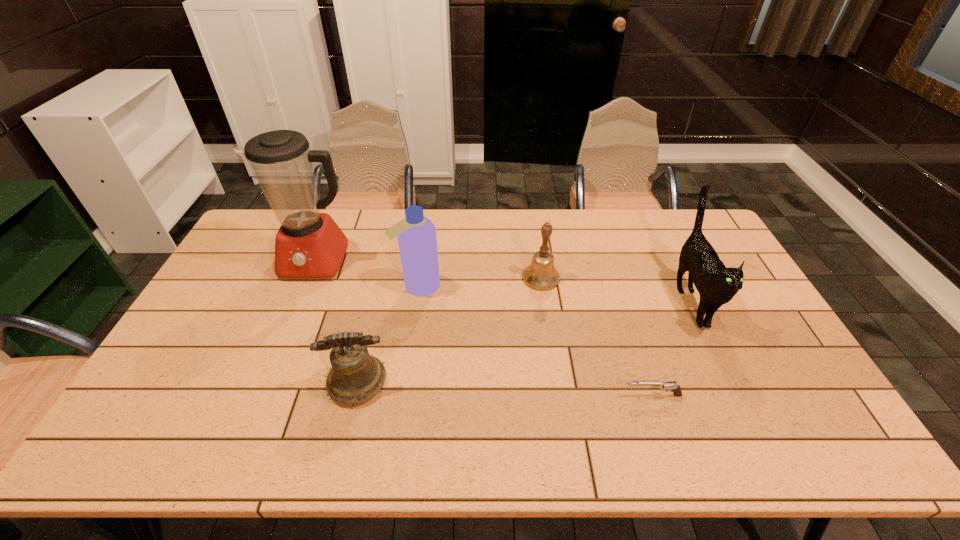
I want to click on the leftmost object, so click(x=309, y=244).

I want to click on blender, so click(x=309, y=244).

You are a GUI agent. You are given a task and a screenshot of the screen. Output one action in this format:
    pyautogui.click(x=<x>, y=<y>)
    Task: Click on the cat
    The height and width of the screenshot is (540, 960).
    Given the screenshot: What is the action you would take?
    pyautogui.click(x=717, y=285)

Find the location of a particular element. The width and height of the screenshot is (960, 540). shampoo is located at coordinates (416, 234).

Image resolution: width=960 pixels, height=540 pixels. I want to click on the taller bell, so click(x=541, y=275).

Locate an element on the screen. Image resolution: width=960 pixels, height=540 pixels. the right bell is located at coordinates pos(541,275).

I want to click on the shorter bell, so click(355, 376).

The image size is (960, 540). Identify the location of the nearer bell. (355, 376).

This screenshot has width=960, height=540. Find the location of `pistol`. pistol is located at coordinates (675, 388).

I want to click on the fifth object from left to right, so click(675, 388).